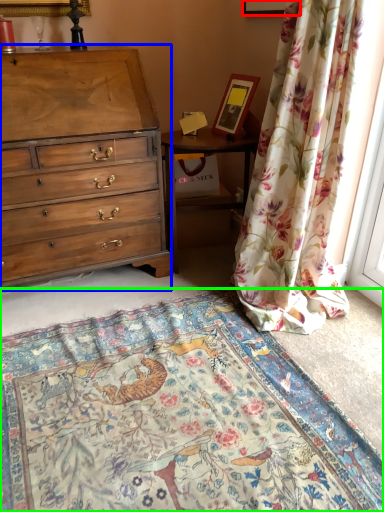
Question: Which object is the farthest from picture frame (highlighted by a red box)? Choose among these: chest of drawers (highlighted by a blue box) or mat (highlighted by a green box).

Choices:
 (A) chest of drawers
 (B) mat

Answer: (B)